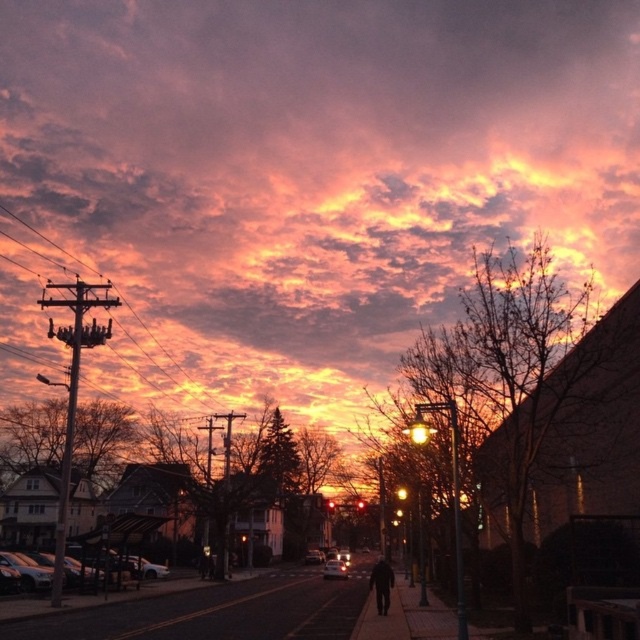
You are standing on the street and want to take a photo of both point (376, 588) and point (333, 561). Since you want both points to be in focus, which point should you focus on to ensure the other is also sharp?

You should focus on point (333, 561) because it is farther from the camera than point (376, 588). By focusing on the farther point, the closer point will also be within the depth of field, ensuring both are sharp.

You are a photographer wanting to capture both the shiny silver car at lower left and the shiny silver sedan at center in a single frame. Given their height difference, which car should you position closer to the camera to ensure both appear balanced in the photo?

The shiny silver car at lower left is much taller than the shiny silver sedan at center. To balance their appearance in the photo, you should position the shiny silver sedan at center closer to the camera so its size in the frame matches the taller shiny silver car at lower left.